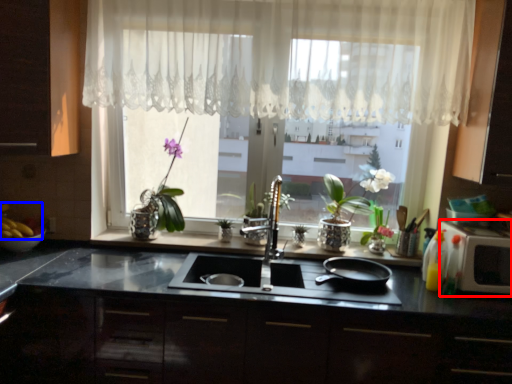
Question: Which object is further to the camera taking this photo, appliance (highlighted by a red box) or food (highlighted by a blue box)?

Choices:
 (A) appliance
 (B) food

Answer: (B)